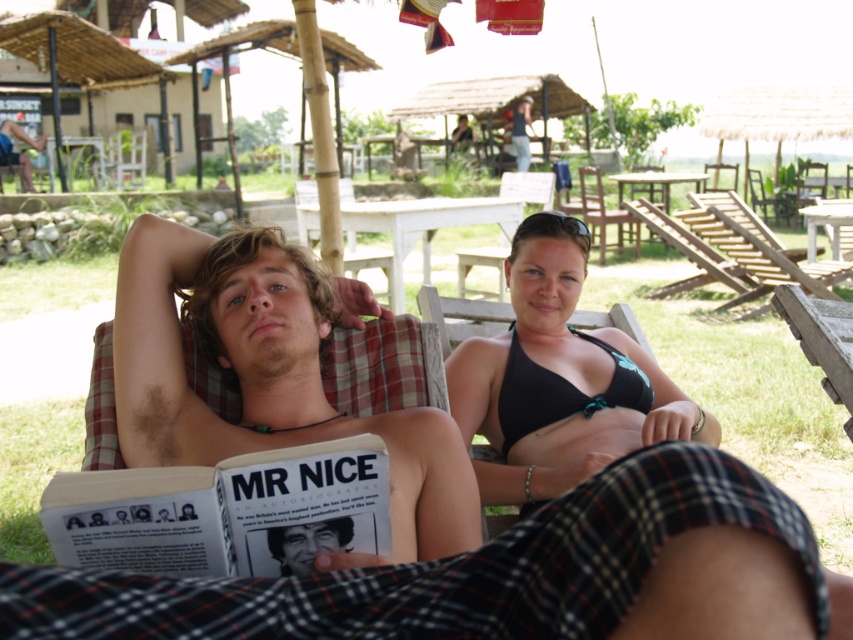
Does point (286, 461) come closer to viewer compared to point (519, 160)?

Yes.

Is white paper book at center bigger than dark blue shirt at upper center?

Actually, white paper book at center might be smaller than dark blue shirt at upper center.

Which is behind, point (248, 557) or point (518, 136)?

Point (518, 136)

Locate an element on the screen. white paper book at center is located at coordinates (225, 512).

Between light brown plaid shirt at center and white paper book at center, which one has more height?

light brown plaid shirt at center is taller.

Does light brown plaid shirt at center have a larger size compared to white paper book at center?

Indeed, light brown plaid shirt at center has a larger size compared to white paper book at center.

Find the location of a particular element. The height and width of the screenshot is (640, 853). light brown plaid shirt at center is located at coordinates (270, 387).

Locate an element on the screen. light brown plaid shirt at center is located at coordinates (270, 387).

Does light brown plaid shirt at center have a greater width compared to wooden chair at center?

Incorrect, light brown plaid shirt at center's width does not surpass wooden chair at center's.

Between light brown plaid shirt at center and wooden chair at center, which one is positioned lower?

light brown plaid shirt at center

Is point (378, 429) farther from viewer compared to point (637, 221)?

No, (378, 429) is in front of (637, 221).

The height and width of the screenshot is (640, 853). Find the location of `light brown plaid shirt at center`. light brown plaid shirt at center is located at coordinates (270, 387).